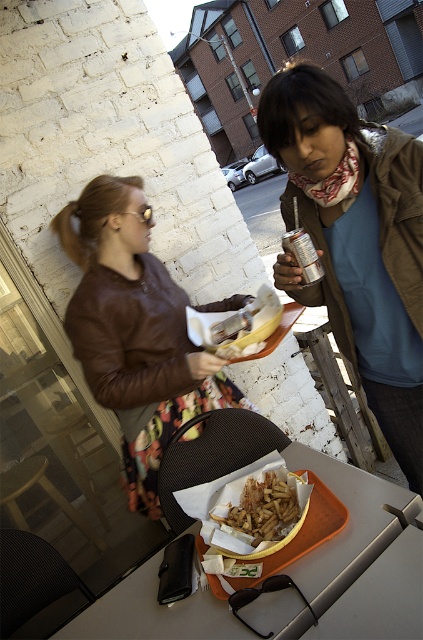
You are a photographer trying to capture a closeup of the orange tray at center without the matte brown leather jacket at center blocking the view. Based on their heights, is this possible?

The matte brown leather jacket at center has a greater height compared to the orange tray at center, so the jacket may block the view of the tray unless adjusted.

You are standing at the origin point in the image. Which of the two points, point [304,113] or point [150,278], is closer to you?

Point [304,113] is closer to the viewer than point [150,278].